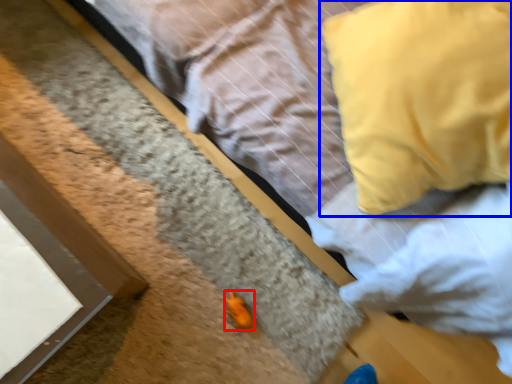
Question: Which of the following is the closest to the observer, miniature (highlighted by a red box) or pillow (highlighted by a blue box)?

Choices:
 (A) miniature
 (B) pillow

Answer: (B)